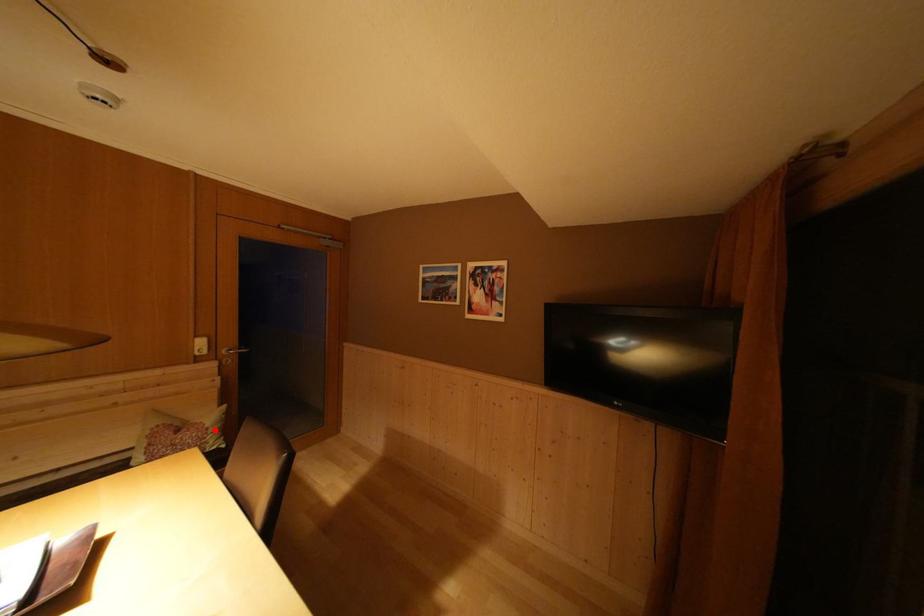
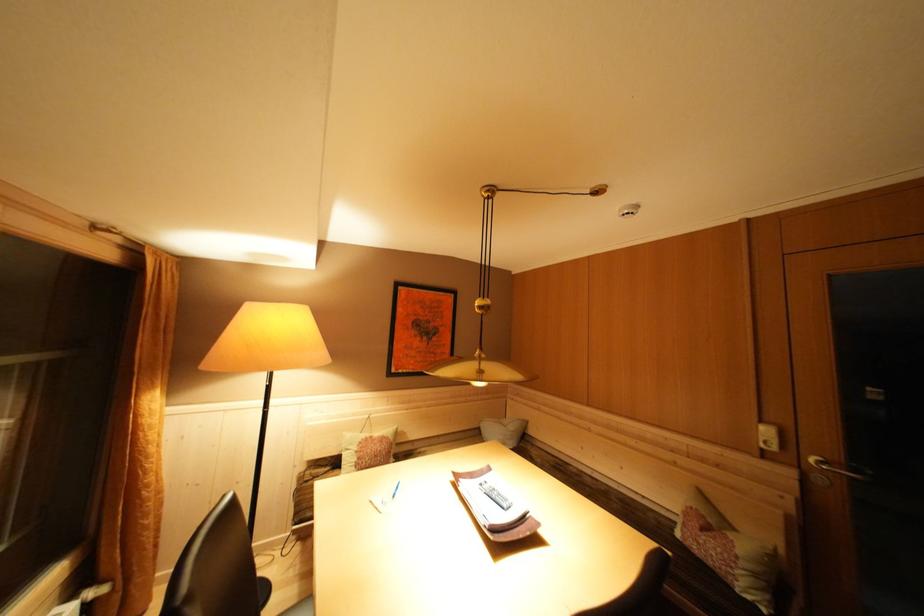
The point at the highlighted location is marked in the first image. Where is the corresponding point in the second image?

(746, 557)